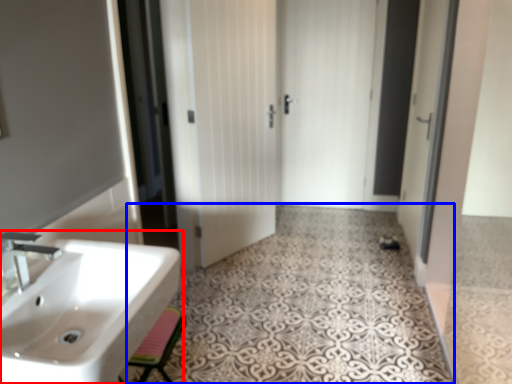
Question: Which object is further to the camera taking this photo, sink (highlighted by a red box) or pattern (highlighted by a blue box)?

Choices:
 (A) sink
 (B) pattern

Answer: (B)